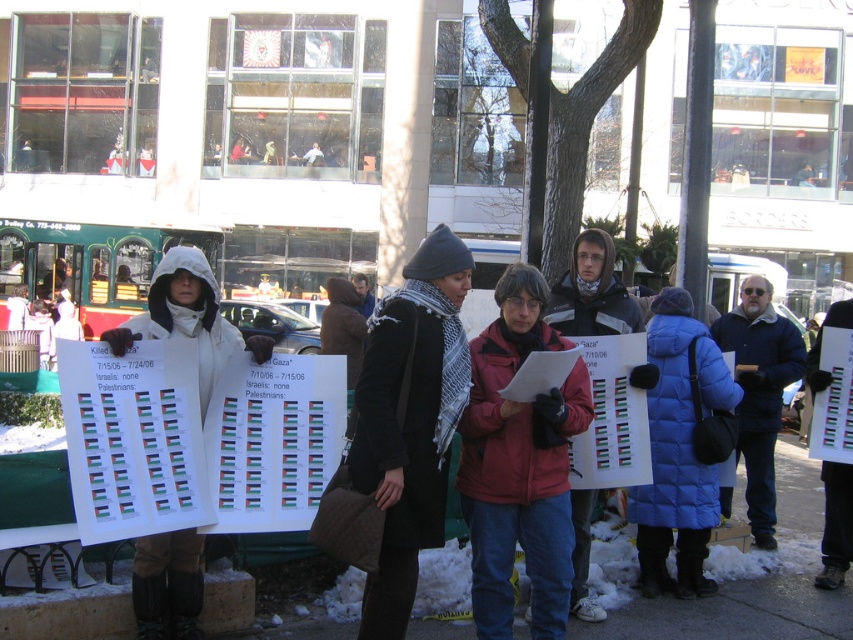
From the picture: Can you confirm if blue down jacket at center is positioned below white fleece jacket at center?

Indeed, blue down jacket at center is positioned under white fleece jacket at center.

Locate an element on the screen. This screenshot has height=640, width=853. blue down jacket at center is located at coordinates (682, 448).

Find the location of a particular element. The height and width of the screenshot is (640, 853). blue down jacket at center is located at coordinates (682, 448).

Between black wool coat at center and dark blue jacket at center, which one is positioned lower?

black wool coat at center

Can you confirm if black wool coat at center is positioned below dark blue jacket at center?

Yes.

Locate an element on the screen. This screenshot has width=853, height=640. black wool coat at center is located at coordinates (410, 420).

Is red matte jacket at center positioned behind blue woolen jacket at center-right?

No, red matte jacket at center is closer to the viewer.

Does red matte jacket at center have a larger size compared to blue woolen jacket at center-right?

Actually, red matte jacket at center might be smaller than blue woolen jacket at center-right.

Which is in front, point (535, 292) or point (758, 513)?

Positioned in front is point (535, 292).

The height and width of the screenshot is (640, 853). What are the coordinates of `red matte jacket at center` in the screenshot? It's located at (519, 465).